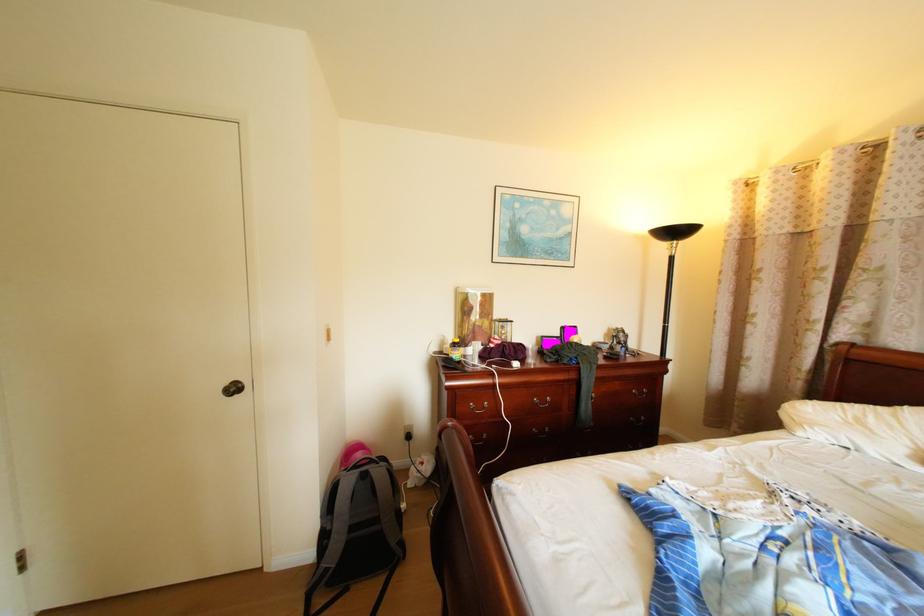
Describe the element at coordinates (233, 387) in the screenshot. Image resolution: width=924 pixels, height=616 pixels. I see `a round door knob` at that location.